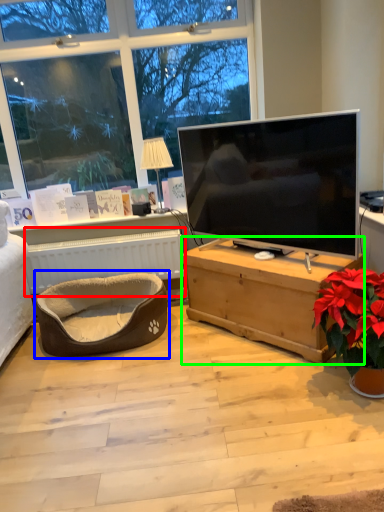
Question: Based on their relative distances, which object is farther from radiator (highlighted by a red box)? Choose from bean bag chair (highlighted by a blue box) and desk (highlighted by a green box).

Choices:
 (A) bean bag chair
 (B) desk

Answer: (B)